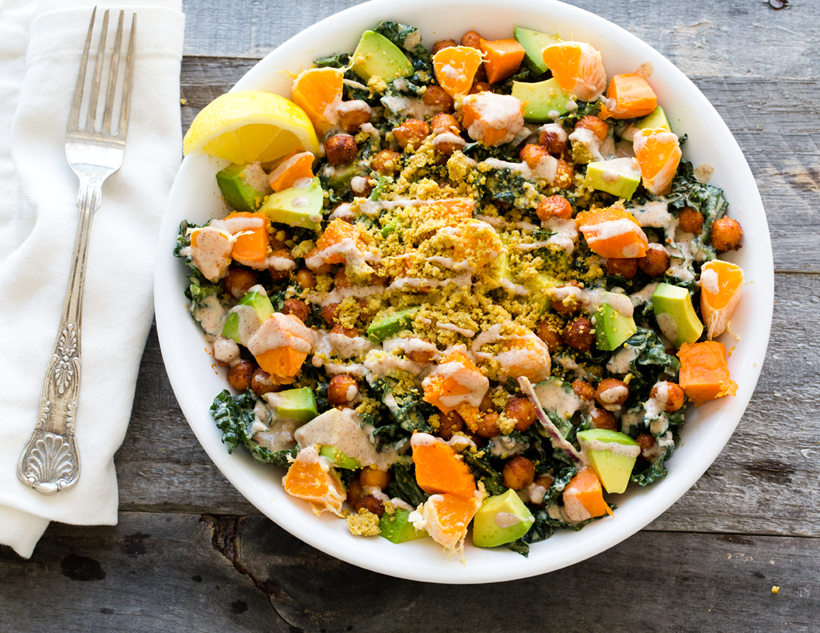
This screenshot has height=633, width=820. Find the location of `dish`. dish is located at coordinates (738, 164).